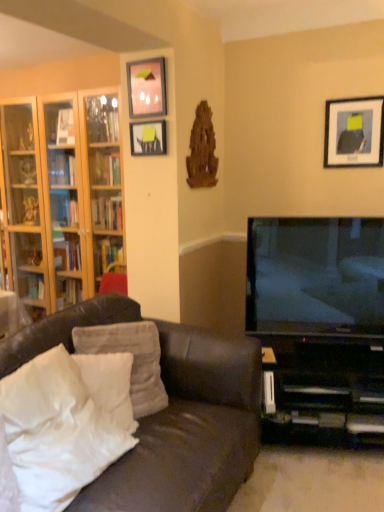
Question: Considering the relative positions of white soft pillow at lower left, the second pillow when ordered from back to front, and matte black tv at right in the image provided, is white soft pillow at lower left, the second pillow when ordered from back to front, in front of matte black tv at right?

Choices:
 (A) yes
 (B) no

Answer: (A)

Question: Is white soft pillow at lower left, the second pillow when ordered from back to front, far away from matte black tv at right?

Choices:
 (A) yes
 (B) no

Answer: (A)

Question: Could you tell me if white soft pillow at lower left, arranged as the 2th pillow when viewed from the front, is facing matte black tv at right?

Choices:
 (A) no
 (B) yes

Answer: (A)

Question: Is white soft pillow at lower left, arranged as the 2th pillow when viewed from the front, taller than matte black tv at right?

Choices:
 (A) yes
 (B) no

Answer: (B)

Question: Would you say white soft pillow at lower left, the second pillow when ordered from back to front, is outside matte black tv at right?

Choices:
 (A) yes
 (B) no

Answer: (A)

Question: From a real-world perspective, is white soft pillow at lower left, arranged as the 2th pillow when viewed from the front, physically above matte black tv at right?

Choices:
 (A) no
 (B) yes

Answer: (A)

Question: Considering the relative positions of matte black picture frame at upper right, marked as the 1th picture frame in a right-to-left arrangement, and black plastic entertainment center at lower right in the image provided, is matte black picture frame at upper right, marked as the 1th picture frame in a right-to-left arrangement, to the right of black plastic entertainment center at lower right from the viewer's perspective?

Choices:
 (A) no
 (B) yes

Answer: (B)

Question: From the image's perspective, is matte black picture frame at upper right, marked as the 1th picture frame in a right-to-left arrangement, located beneath black plastic entertainment center at lower right?

Choices:
 (A) no
 (B) yes

Answer: (A)

Question: Considering the relative sizes of matte black picture frame at upper right, the 3th picture frame viewed from the left, and black plastic entertainment center at lower right in the image provided, is matte black picture frame at upper right, the 3th picture frame viewed from the left, bigger than black plastic entertainment center at lower right?

Choices:
 (A) yes
 (B) no

Answer: (B)

Question: Considering the relative positions of matte black picture frame at upper right, the 3th picture frame viewed from the left, and black plastic entertainment center at lower right in the image provided, is matte black picture frame at upper right, the 3th picture frame viewed from the left, in front of black plastic entertainment center at lower right?

Choices:
 (A) no
 (B) yes

Answer: (A)

Question: Is matte black picture frame at upper right, marked as the 1th picture frame in a right-to-left arrangement, shorter than black plastic entertainment center at lower right?

Choices:
 (A) no
 (B) yes

Answer: (B)

Question: Can you confirm if matte black picture frame at upper right, the 3th picture frame viewed from the left, is smaller than black plastic entertainment center at lower right?

Choices:
 (A) no
 (B) yes

Answer: (B)

Question: Considering the relative sizes of wooden bookshelf at left and white soft pillow at lower left, arranged as the first pillow when viewed from the back, in the image provided, is wooden bookshelf at left bigger than white soft pillow at lower left, arranged as the first pillow when viewed from the back,?

Choices:
 (A) yes
 (B) no

Answer: (A)